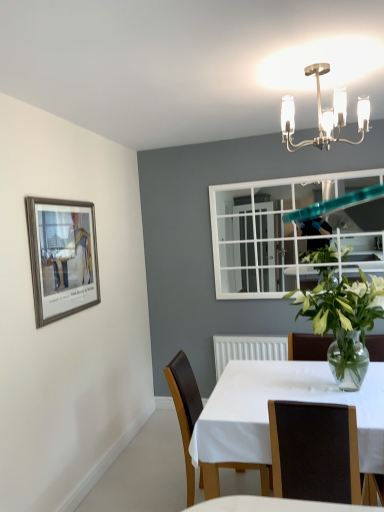
Question: Can you confirm if clear glass vase at center is taller than polished brass chandelier at upper center?

Choices:
 (A) no
 (B) yes

Answer: (B)

Question: Is clear glass vase at center closer to camera compared to polished brass chandelier at upper center?

Choices:
 (A) no
 (B) yes

Answer: (A)

Question: Does clear glass vase at center have a lesser height compared to polished brass chandelier at upper center?

Choices:
 (A) no
 (B) yes

Answer: (A)

Question: Is clear glass vase at center to the right of polished brass chandelier at upper center from the viewer's perspective?

Choices:
 (A) yes
 (B) no

Answer: (A)

Question: From the image's perspective, is clear glass vase at center on polished brass chandelier at upper center?

Choices:
 (A) yes
 (B) no

Answer: (B)

Question: Is clear glass vase at center far away from polished brass chandelier at upper center?

Choices:
 (A) yes
 (B) no

Answer: (B)

Question: Is brown leather chair at center, the second chair viewed from the back, shorter than brown leather chair at center, positioned as the 2th chair in front-to-back order?

Choices:
 (A) no
 (B) yes

Answer: (B)

Question: Considering the relative sizes of brown leather chair at center, the second chair viewed from the back, and brown leather chair at center, positioned as the 2th chair in front-to-back order, in the image provided, is brown leather chair at center, the second chair viewed from the back, taller than brown leather chair at center, positioned as the 2th chair in front-to-back order,?

Choices:
 (A) no
 (B) yes

Answer: (A)

Question: Does brown leather chair at center, the 1th chair viewed from the front, have a greater width compared to brown leather chair at center, positioned as the 2th chair in front-to-back order?

Choices:
 (A) no
 (B) yes

Answer: (A)

Question: Does brown leather chair at center, the 1th chair viewed from the front, appear on the left side of brown leather chair at center, positioned as the 2th chair in front-to-back order?

Choices:
 (A) no
 (B) yes

Answer: (A)

Question: Is brown leather chair at center, the 1th chair viewed from the front, outside of brown leather chair at center, positioned as the 2th chair in front-to-back order?

Choices:
 (A) yes
 (B) no

Answer: (A)

Question: Is brown leather chair at center, the second chair viewed from the back, positioned far away from brown leather chair at center, placed as the first chair when sorted from back to front?

Choices:
 (A) no
 (B) yes

Answer: (A)

Question: Does polished brass chandelier at upper center have a lesser height compared to white glossy table at center?

Choices:
 (A) no
 (B) yes

Answer: (B)